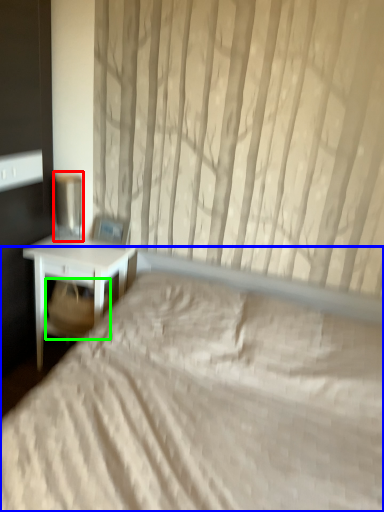
Question: Which object is the closest to the table lamp (highlighted by a red box)? Choose among these: bed (highlighted by a blue box) or swivel chair (highlighted by a green box).

Choices:
 (A) bed
 (B) swivel chair

Answer: (B)